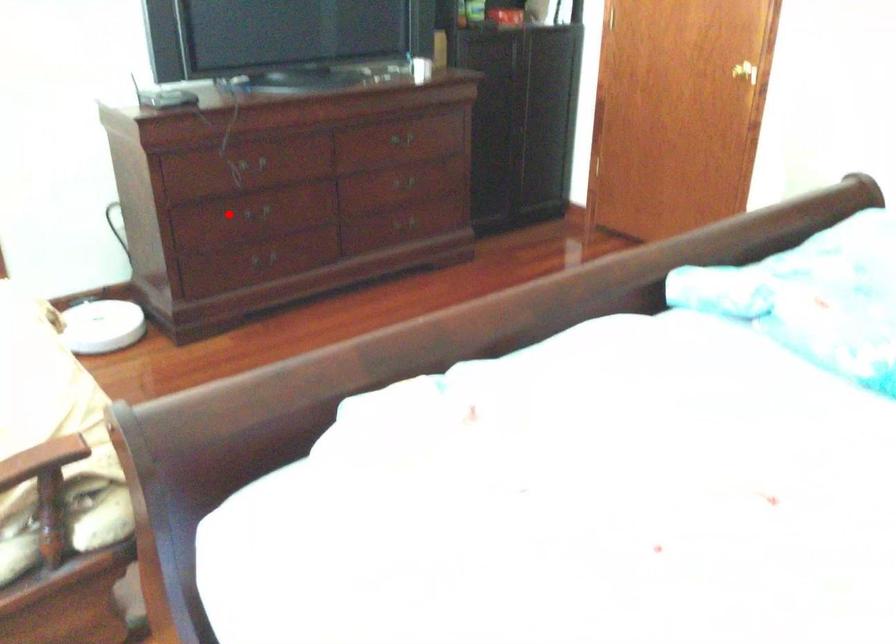
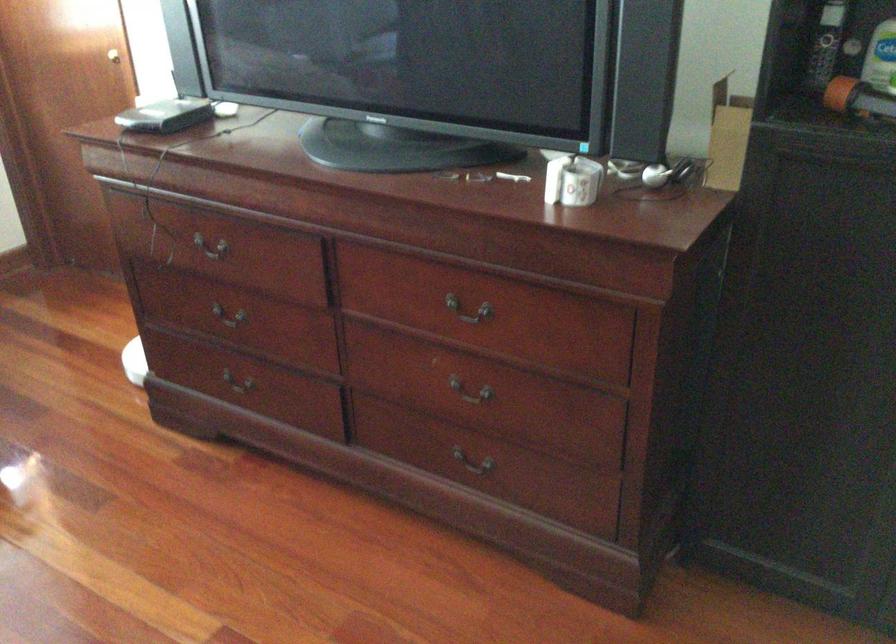
The point at the highlighted location is marked in the first image. Where is the corresponding point in the second image?

(229, 313)